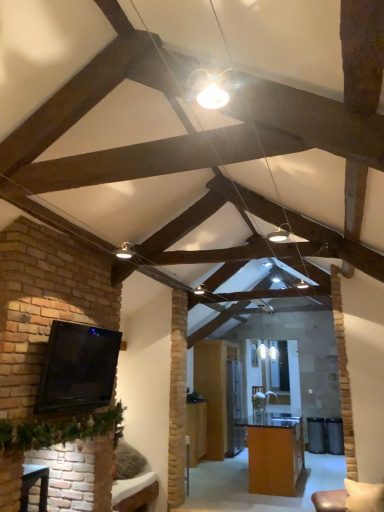
Question: Is matte white bulb at center situated inside brick fireplace at lower left or outside?

Choices:
 (A) inside
 (B) outside

Answer: (B)

Question: Considering the positions of matte white bulb at center and brick fireplace at lower left in the image, is matte white bulb at center taller or shorter than brick fireplace at lower left?

Choices:
 (A) short
 (B) tall

Answer: (A)

Question: Which is nearer to the black glossy tv at left?

Choices:
 (A) orange glossy table at center, marked as the 2th table in a left-to-right arrangement
 (B) matte white bulb at center
 (C) brick fireplace at lower left
 (D) wooden table at center, which is the first table from left to right

Answer: (C)

Question: Considering the real-world distances, which object is farthest from the black glossy tv at left?

Choices:
 (A) wooden table at center, which is the first table from left to right
 (B) brick fireplace at lower left
 (C) matte white bulb at center
 (D) orange glossy table at center, positioned as the 1th table in right-to-left order

Answer: (A)